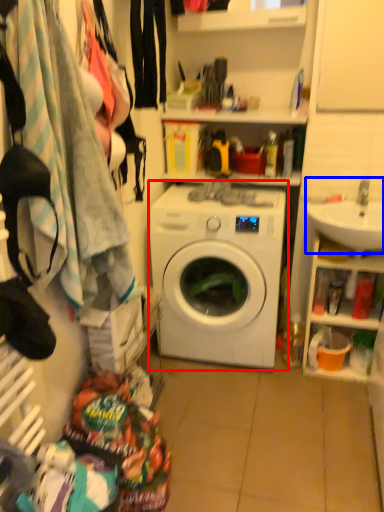
Question: Among these objects, which one is nearest to the camera, washing machine (highlighted by a red box) or sink (highlighted by a blue box)?

Choices:
 (A) washing machine
 (B) sink

Answer: (B)